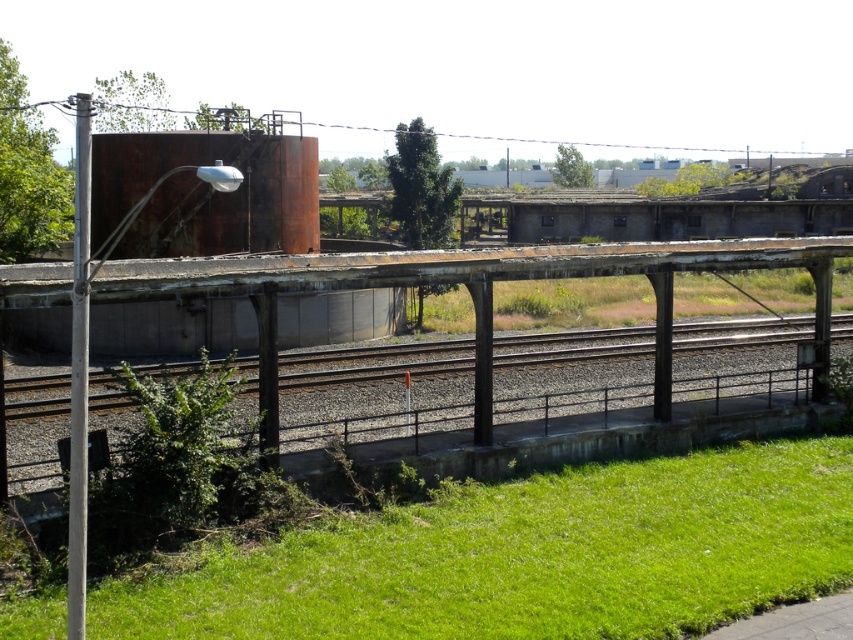
Does rusty metal train track at center have a lesser height compared to green leafy plant at lower left?

In fact, rusty metal train track at center may be taller than green leafy plant at lower left.

Is point (691, 333) positioned in front of point (209, 474)?

That is False.

Between point (450, 340) and point (148, 397), which one is positioned behind?

The point (450, 340) is more distant.

Find the location of a particular element. This screenshot has width=853, height=640. rusty metal train track at center is located at coordinates (372, 364).

Is rusty metal platform at center positioned in front of rusty metal train track at center?

That is True.

Which is behind, point (202, 292) or point (691, 348)?

Positioned behind is point (691, 348).

What are the coordinates of `rusty metal platform at center` in the screenshot? It's located at (369, 285).

Locate an element on the screen. Image resolution: width=853 pixels, height=640 pixels. green grass at lower center is located at coordinates [x=531, y=556].

Between green grass at lower center and green leafy plant at lower left, which one has less height?

green grass at lower center

Who is more distant from viewer, (412, 522) or (149, 376)?

Positioned behind is point (149, 376).

In order to click on green grass at lower center in this screenshot , I will do `click(531, 556)`.